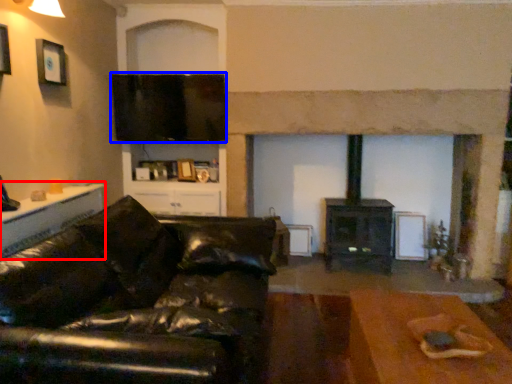
Question: Which object is closer to the camera taking this photo, table (highlighted by a red box) or window screen (highlighted by a blue box)?

Choices:
 (A) table
 (B) window screen

Answer: (A)